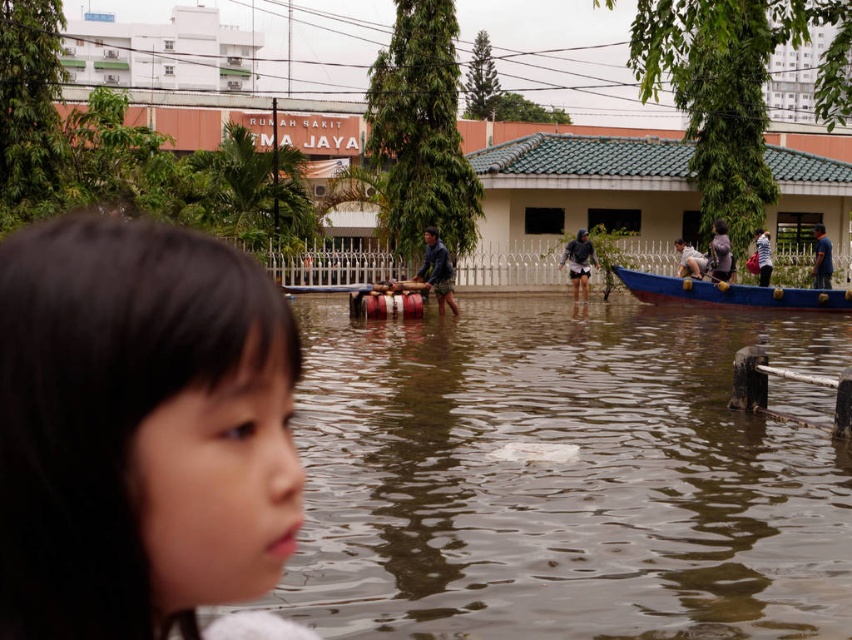
Based on the photo, you are a rescue worker trying to navigate through the flooded area. You see the brown matte water at center and the blue wooden canoe at right. Which path should you choose to ensure your boat can fit through the narrower sections?

The blue wooden canoe at right is narrower than the brown matte water at center, so choosing the path with the blue wooden canoe at right would allow your boat to fit through narrower sections.